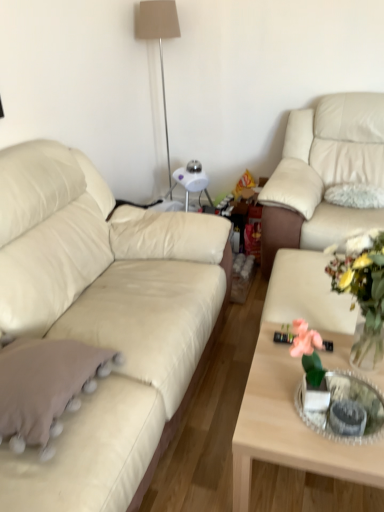
What is the approximate height of clear glass tray at center?

clear glass tray at center is 5.07 centimeters tall.

Locate an element on the screen. The image size is (384, 512). matte beige lampshade at upper center is located at coordinates (158, 39).

In the scene shown: Measure the distance between beige fabric throw pillow at lower left and camera.

The depth of beige fabric throw pillow at lower left is 1.11 meters.

Describe the element at coordinates (44, 385) in the screenshot. The height and width of the screenshot is (512, 384). I see `beige fabric throw pillow at lower left` at that location.

The image size is (384, 512). I want to click on clear glass tray at center, so click(x=344, y=400).

From the image's perspective, is matte beige lampshade at upper center over translucent glass vase at center?

Yes, from the image's perspective, matte beige lampshade at upper center is above translucent glass vase at center.

Can you see matte beige lampshade at upper center touching translucent glass vase at center?

No.

Does matte beige lampshade at upper center come in front of translucent glass vase at center?

No, it is behind translucent glass vase at center.

Considering the sizes of objects matte beige lampshade at upper center and translucent glass vase at center in the image provided, who is wider, matte beige lampshade at upper center or translucent glass vase at center?

matte beige lampshade at upper center.

Can you confirm if beige leather couch at left, which is counted as the 1th studio couch, starting from the left, is taller than light wood coffee table at center?

Indeed, beige leather couch at left, which is counted as the 1th studio couch, starting from the left, has a greater height compared to light wood coffee table at center.

Considering the positions of objects beige leather couch at left, which is counted as the 1th studio couch, starting from the left, and light wood coffee table at center in the image provided, who is behind, beige leather couch at left, which is counted as the 1th studio couch, starting from the left, or light wood coffee table at center?

light wood coffee table at center is further away from the camera.

Is beige leather couch at left, the 2th studio couch when ordered from right to left, turned away from light wood coffee table at center?

No, beige leather couch at left, the 2th studio couch when ordered from right to left,'s orientation is not away from light wood coffee table at center.

Which of these two, beige leather couch at left, the 2th studio couch when ordered from right to left, or light wood coffee table at center, is smaller?

With smaller size is light wood coffee table at center.

Is light wood coffee table at center behind translucent glass vase at center?

Yes, light wood coffee table at center is further from the camera.

From the image's perspective, is light wood coffee table at center under translucent glass vase at center?

Yes, from the image's perspective, light wood coffee table at center is below translucent glass vase at center.

Based on the photo, which is nearer, (281,416) or (358,238)?

Positioned in front is point (281,416).

How distant is light wood coffee table at center from translucent glass vase at center?

They are 11.81 inches apart.

How much distance is there between fuzzy white pillow at upper right and matte beige lampshade at upper center?

They are 5.17 feet apart.

From a real-world perspective, does fuzzy white pillow at upper right stand above matte beige lampshade at upper center?

Actually, fuzzy white pillow at upper right is physically below matte beige lampshade at upper center in the real world.

From the image's perspective, relative to matte beige lampshade at upper center, is fuzzy white pillow at upper right above or below?

Based on their image positions, fuzzy white pillow at upper right is located beneath matte beige lampshade at upper center.

From the picture: Between beige leather couch at right, the 1th studio couch from the right, and clear glass tray at center, which one has less height?

With less height is clear glass tray at center.

From a real-world perspective, which studio couch is the 2nd one above the clear glass tray at center? Please provide its 2D coordinates.

[(323, 173)]

Consider the image. From the image's perspective, is beige leather couch at right, which appears as the second studio couch when viewed from the left, over clear glass tray at center?

Yes, from the image's perspective, beige leather couch at right, which appears as the second studio couch when viewed from the left, is above clear glass tray at center.

Is fuzzy white pillow at upper right at the left side of clear glass tray at center?

No, fuzzy white pillow at upper right is not to the left of clear glass tray at center.

Is the surface of fuzzy white pillow at upper right in direct contact with clear glass tray at center?

They are not placed beside each other.

From a real-world perspective, is fuzzy white pillow at upper right on clear glass tray at center?

Yes, from a real-world perspective, fuzzy white pillow at upper right is above clear glass tray at center.

Does point (369, 408) come farther from viewer compared to point (173, 27)?

No, (369, 408) is in front of (173, 27).

From the image's perspective, which one is positioned lower, clear glass tray at center or matte beige lampshade at upper center?

clear glass tray at center appears lower in the image.

Is clear glass tray at center beside matte beige lampshade at upper center?

No, clear glass tray at center is not beside matte beige lampshade at upper center.

Considering the sizes of objects clear glass tray at center and matte beige lampshade at upper center in the image provided, who is taller, clear glass tray at center or matte beige lampshade at upper center?

matte beige lampshade at upper center.

At what (x,y) coordinates should I click in order to perform the action: click on table lamp behind the translucent glass vase at center. Please return your answer as a coordinate pair (x, y). This screenshot has height=512, width=384. Looking at the image, I should click on (158, 39).

Where is `coffee table lying on the right of beige leather couch at left, the 2th studio couch when ordered from right to left`? coffee table lying on the right of beige leather couch at left, the 2th studio couch when ordered from right to left is located at coordinates (289, 426).

Which object lies nearer to the anchor point translucent glass vase at center, beige fabric throw pillow at lower left or beige leather couch at left, which is counted as the 1th studio couch, starting from the left?

beige fabric throw pillow at lower left is closer to translucent glass vase at center.

Based on their spatial positions, is beige leather couch at left, the 2th studio couch when ordered from right to left, or translucent glass vase at center closer to light wood coffee table at center?

translucent glass vase at center lies closer to light wood coffee table at center than the other object.

When comparing their distances from matte beige lampshade at upper center, does beige leather couch at left, the 2th studio couch when ordered from right to left, or beige leather couch at right, which appears as the second studio couch when viewed from the left, seem closer?

beige leather couch at right, which appears as the second studio couch when viewed from the left, lies closer to matte beige lampshade at upper center than the other object.

Estimate the real-world distances between objects in this image. Which object is further from clear glass tray at center, matte beige lampshade at upper center or fuzzy white pillow at upper right?

The object further to clear glass tray at center is matte beige lampshade at upper center.

Considering their positions, is beige fabric throw pillow at lower left positioned further to clear glass tray at center than beige leather couch at right, the 1th studio couch from the right?

beige leather couch at right, the 1th studio couch from the right, is further to clear glass tray at center.

Considering their positions, is fuzzy white pillow at upper right positioned closer to light wood coffee table at center than clear glass tray at center?

clear glass tray at center is closer to light wood coffee table at center.

Which object lies further to the anchor point beige leather couch at right, which appears as the second studio couch when viewed from the left, light wood coffee table at center or matte beige lampshade at upper center?

matte beige lampshade at upper center is positioned further to the anchor beige leather couch at right, which appears as the second studio couch when viewed from the left.

Based on their spatial positions, is light wood coffee table at center or translucent glass vase at center closer to clear glass tray at center?

Based on the image, light wood coffee table at center appears to be nearer to clear glass tray at center.

Where is `coffee table situated between beige leather couch at left, the 2th studio couch when ordered from right to left, and beige leather couch at right, which appears as the second studio couch when viewed from the left, from left to right`? The height and width of the screenshot is (512, 384). coffee table situated between beige leather couch at left, the 2th studio couch when ordered from right to left, and beige leather couch at right, which appears as the second studio couch when viewed from the left, from left to right is located at coordinates tap(289, 426).

Find the location of a particular element. studio couch situated between beige fabric throw pillow at lower left and beige leather couch at right, which appears as the second studio couch when viewed from the left, from left to right is located at coordinates (103, 319).

The width and height of the screenshot is (384, 512). Identify the location of floral arrangement between beige fabric throw pillow at lower left and matte beige lampshade at upper center from front to back. coord(364,292).

Image resolution: width=384 pixels, height=512 pixels. In order to click on floral arrangement between beige fabric throw pillow at lower left and beige leather couch at right, which appears as the second studio couch when viewed from the left, in the horizontal direction in this screenshot , I will do `click(364, 292)`.